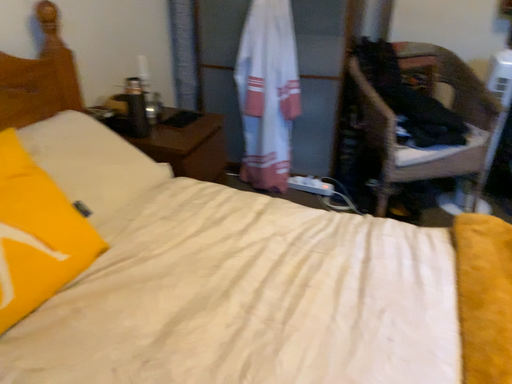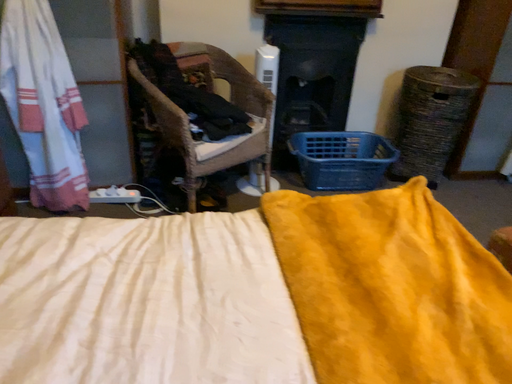
Question: Which way did the camera rotate in the video?

Choices:
 (A) rotated left
 (B) rotated right

Answer: (B)